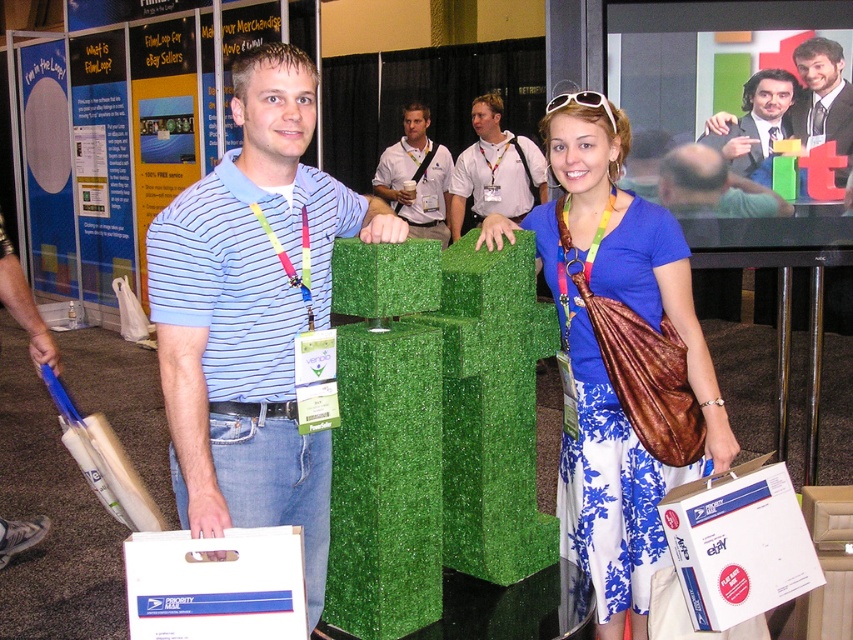
Question: Which object appears closest to the camera in this image?

Choices:
 (A) light blue striped polo shirt at center
 (B) striped cotton polo shirt at center
 (C) smooth suit at upper right
 (D) white matte plastic bag at lower center

Answer: (D)

Question: Is blue satin dress at center bigger than light blue striped polo shirt at center?

Choices:
 (A) yes
 (B) no

Answer: (B)

Question: Is white matte box at lower right to the right of smooth suit at upper right from the viewer's perspective?

Choices:
 (A) yes
 (B) no

Answer: (B)

Question: In this image, where is white matte plastic bag at lower center located relative to light blue striped polo shirt at center?

Choices:
 (A) below
 (B) above

Answer: (A)

Question: Estimate the real-world distances between objects in this image. Which object is farther from the white matte box at lower right?

Choices:
 (A) smooth suit at upper right
 (B) white matte plastic bag at lower center

Answer: (A)

Question: Estimate the real-world distances between objects in this image. Which object is farther from the blue satin dress at center?

Choices:
 (A) smooth suit at upper right
 (B) white matte box at lower right
 (C) light blue striped polo shirt at center

Answer: (C)